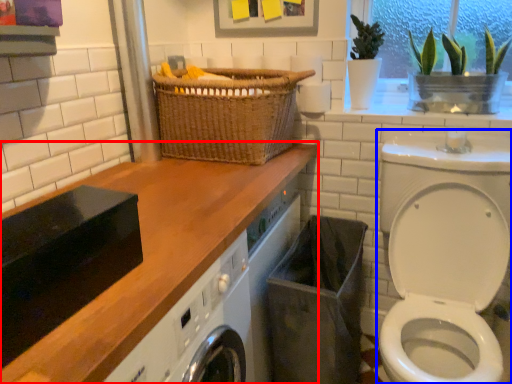
Question: Among these objects, which one is nearest to the camera, countertop (highlighted by a red box) or washer (highlighted by a blue box)?

Choices:
 (A) countertop
 (B) washer

Answer: (A)